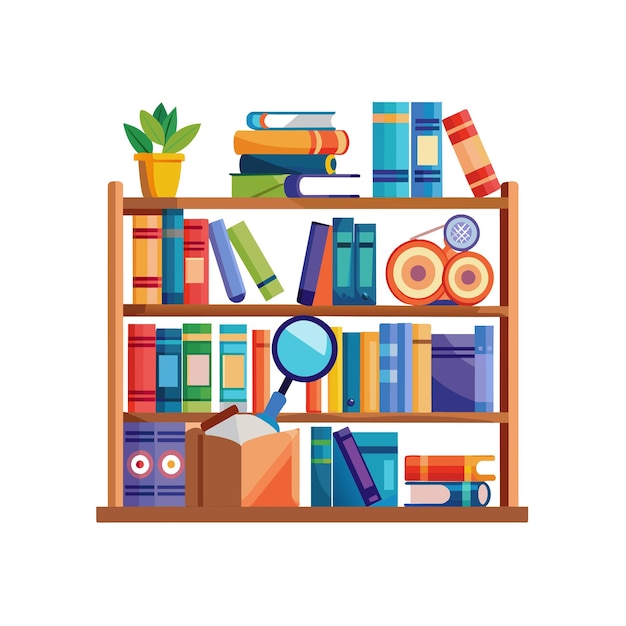
I want to click on book stacked on top of another book, so click(453, 463), click(285, 118), click(284, 135), click(289, 163).